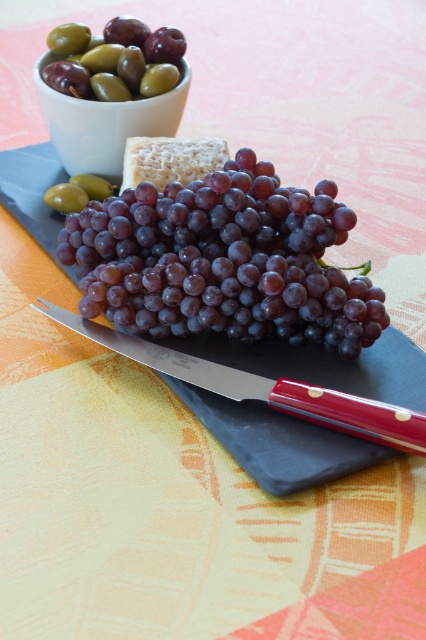
You are looking at the snack setup on the table. There are two points marked on the image. The first point is at coordinates point (201, 269) and the second is at point (391, 429). From your perspective, which point is closer to you?

Point (391, 429) is closer to you because point (201, 269) is behind it.

You are setting up a snack table and want to place a decorative plate in front of the shiny purple grapes at center so it can be seen easily. Where should you place the plate relative to the polished red handle knife at center?

The polished red handle knife at center is behind the shiny purple grapes at center, so placing the decorative plate in front of the shiny purple grapes at center would mean positioning it in front of the polished red handle knife at center as well.

You are setting up a snack table and want to place a small decorative item between the polished red handle knife at center and the green olive at upper left. Based on their widths, will there be enough space for the item if it requires 2 cm of space?

The polished red handle knife at center might be wider than green olive at upper left, so the space between them may not be sufficient for a 2 cm decorative item. Check the exact width difference to confirm.